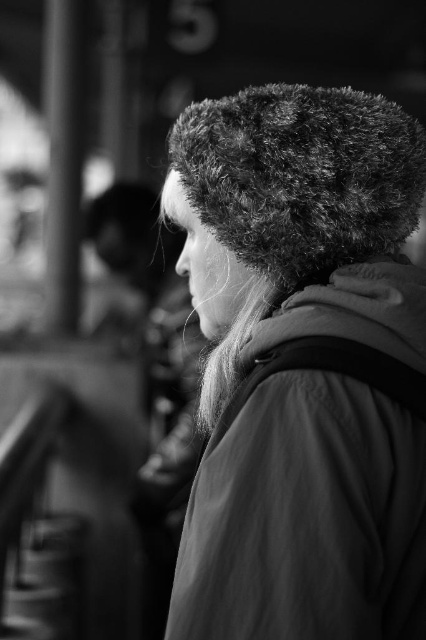
In the black and white photo, there are two fuzzy fur hats. The first is the fuzzy fur hat at center and the second is the fuzzy fur hat at upper center. Which one is positioned to the left?

The fuzzy fur hat at center is to the left of the fuzzy fur hat at upper center.

Based on the scene description, where is the fuzzy fur hat at center located in terms of coordinates?

The fuzzy fur hat at center is located at coordinates point (x=302, y=365).